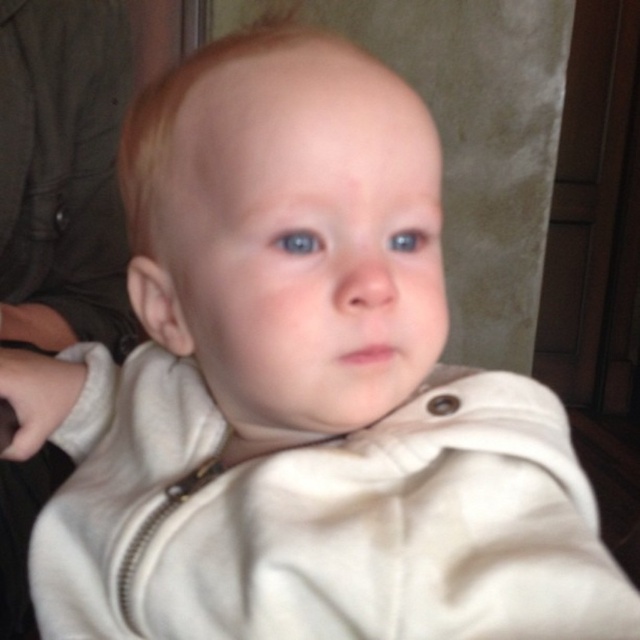
Question: Does blue glossy eye at center have a lesser width compared to blue glossy eye at upper center?

Choices:
 (A) no
 (B) yes

Answer: (A)

Question: Can you confirm if white soft jacket at center is positioned above blue glossy eye at center?

Choices:
 (A) no
 (B) yes

Answer: (A)

Question: Which point is farther from the camera taking this photo?

Choices:
 (A) (413, 237)
 (B) (307, 237)
 (C) (35, 124)

Answer: (C)

Question: Is blue glossy eye at center further to camera compared to blue glossy eye at upper center?

Choices:
 (A) yes
 (B) no

Answer: (B)

Question: Which object appears farthest from the camera in this image?

Choices:
 (A) white soft jacket at center
 (B) blue glossy eye at upper center

Answer: (A)

Question: Which of the following is the closest to the observer?

Choices:
 (A) blue glossy eye at upper center
 (B) blue glossy eye at center

Answer: (B)